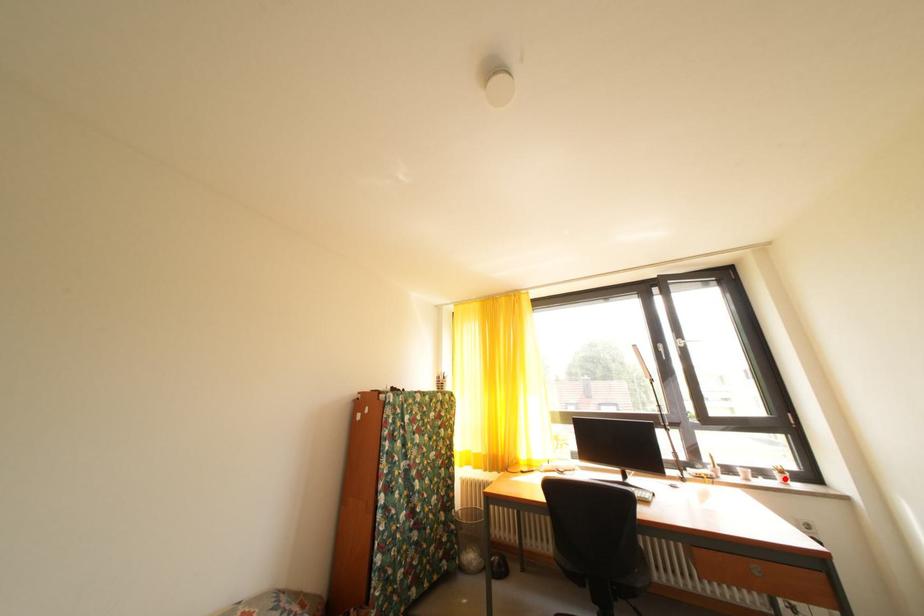
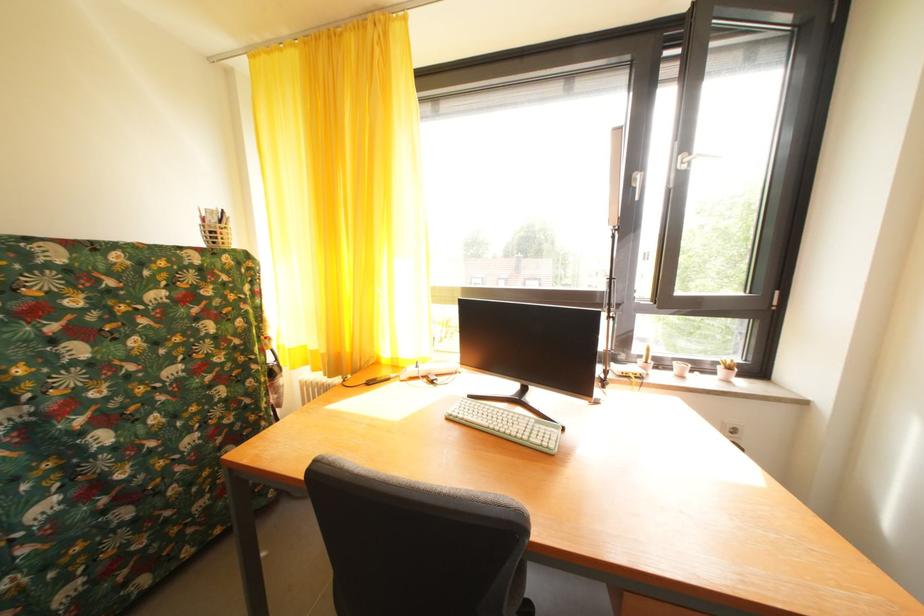
In the second image, find the point that corresponds to the highlighted location in the first image.

(728, 374)